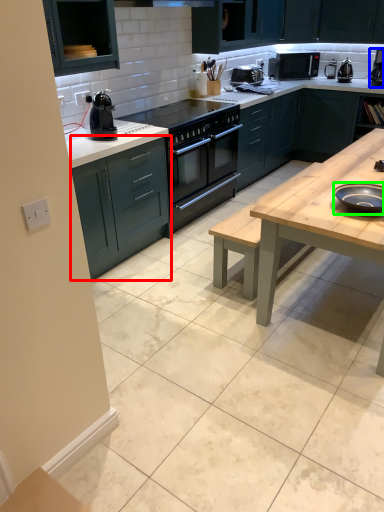
Question: Which is nearer to the cabinetry (highlighted by a red box)? coffee machine (highlighted by a blue box) or appliance (highlighted by a green box).

Choices:
 (A) coffee machine
 (B) appliance

Answer: (B)